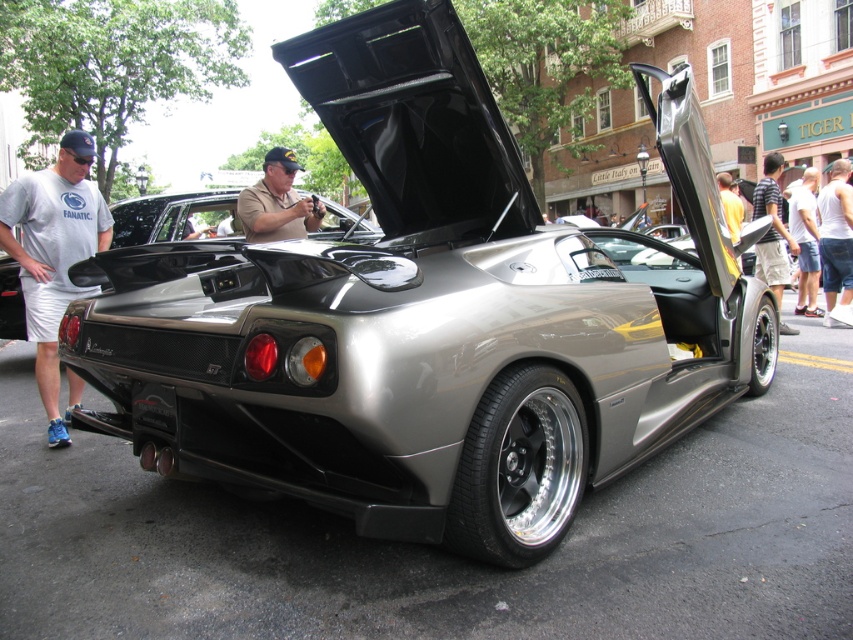
Can you confirm if gray fabric shirt at left is shorter than white cotton shirt at right?

Yes.

Between gray fabric shirt at left and white cotton shirt at right, which one has more height?

white cotton shirt at right

At what (x,y) coordinates should I click in order to perform the action: click on gray fabric shirt at left. Please return your answer as a coordinate pair (x, y). The height and width of the screenshot is (640, 853). Looking at the image, I should click on (54, 257).

Locate an element on the screen. gray fabric shirt at left is located at coordinates (54, 257).

Based on the photo, is white cotton tank top at center taller than white cotton shirt at right?

Correct, white cotton tank top at center is much taller as white cotton shirt at right.

Is white cotton tank top at center closer to camera compared to white cotton shirt at right?

Yes, it is in front of white cotton shirt at right.

Who is more distant from viewer, (824, 262) or (805, 314)?

Point (805, 314)

At what (x,y) coordinates should I click in order to perform the action: click on white cotton tank top at center. Please return your answer as a coordinate pair (x, y). The width and height of the screenshot is (853, 640). Looking at the image, I should click on (836, 236).

Which of these two, white cotton tank top at center or striped shirt at center, stands shorter?

With less height is white cotton tank top at center.

Between point (838, 288) and point (785, 273), which one is positioned in front?

Point (785, 273) is more forward.

At what (x,y) coordinates should I click in order to perform the action: click on white cotton tank top at center. Please return your answer as a coordinate pair (x, y). This screenshot has height=640, width=853. Looking at the image, I should click on (836, 236).

Where is `white cotton tank top at center`? The height and width of the screenshot is (640, 853). white cotton tank top at center is located at coordinates (836, 236).